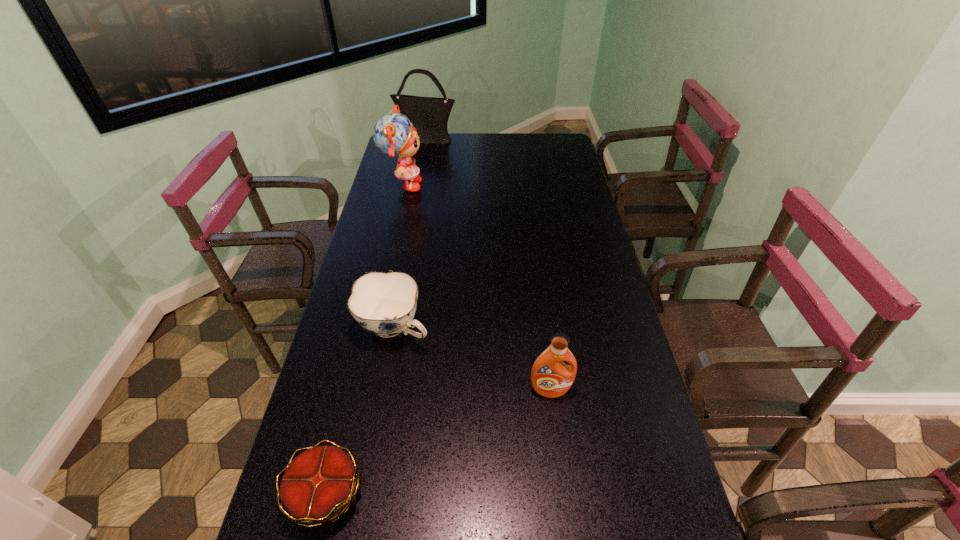
Identify the location of the farthest object. (429, 115).

In order to click on doll in this screenshot , I will do `click(393, 134)`.

At what (x,y) coordinates should I click in order to perform the action: click on the fourth farthest object. Please return your answer as a coordinate pair (x, y). Looking at the image, I should click on (550, 377).

The width and height of the screenshot is (960, 540). I want to click on the third shortest object, so click(x=550, y=377).

The image size is (960, 540). Identify the location of chinaware. (384, 304).

Where is `the third farthest object`? The height and width of the screenshot is (540, 960). the third farthest object is located at coordinates (384, 304).

Where is `the shortest object`? The image size is (960, 540). the shortest object is located at coordinates (318, 487).

You are a GUI agent. You are given a task and a screenshot of the screen. Output one action in this format:
    pyautogui.click(x=<x>, y=<y>)
    Task: Click on the nearest object
    Image resolution: width=960 pixels, height=540 pixels.
    Given the screenshot: What is the action you would take?
    pyautogui.click(x=318, y=487)

Locate an element on the screen. This screenshot has height=540, width=960. vacant space situated on the right of the shoulder bag is located at coordinates (513, 138).

Identify the location of vacant region located 0.360m on the face of the second farthest object. (513, 186).